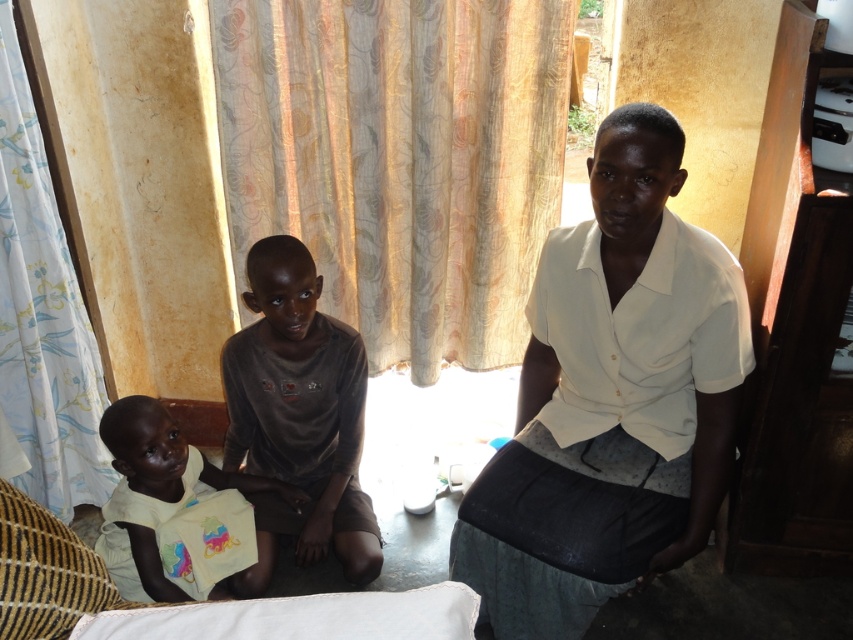
In the scene described, there is a white matte shirt at center and a light yellow fabric at lower left. Which object is taller?

The white matte shirt at center is taller than the light yellow fabric at lower left.

You are standing in the room and want to know where the white floral fabric curtain at left is positioned relative to the center of the image. Can you determine its location?

The white floral fabric curtain at left is located at point (42, 314), which places it near the center horizontally and closer to the top vertically compared to the center of the image.

You are organizing a small gathering in the room described. You need to place a decorative pillow between the brown cotton shirt at center and the white floral fabric curtain at left. Based on their positions, where should you place the pillow?

The brown cotton shirt at center is to the right of the white floral fabric curtain at left, so you should place the pillow between them, positioning it to the right of the white floral fabric curtain at left and to the left of the brown cotton shirt at center.